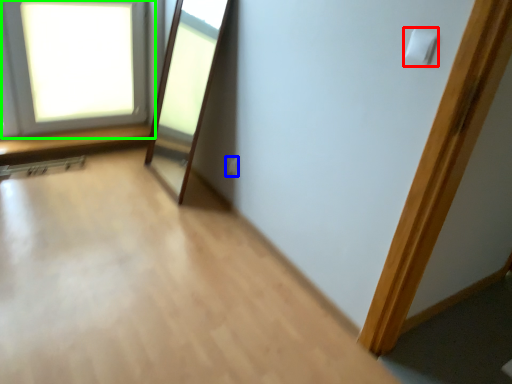
Question: Estimate the real-world distances between objects in this image. Which object is closer to light switch (highlighted by a red box), electric outlet (highlighted by a blue box) or window (highlighted by a green box)?

Choices:
 (A) electric outlet
 (B) window

Answer: (A)